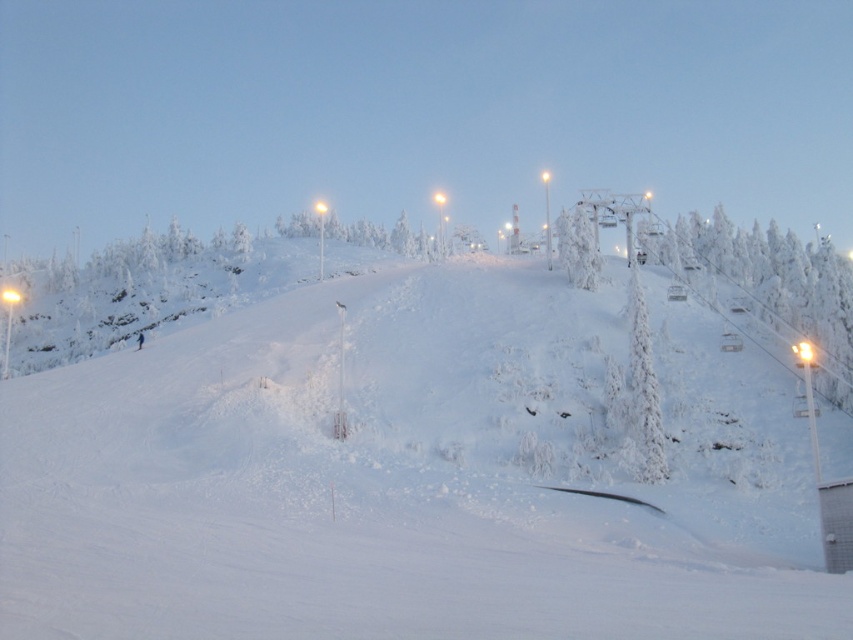
You are a skier planning to take a photo of the white frosty tree at upper center while standing on the white snow ski slope at center. Which direction should you face to capture the tree in your photo?

You should face to the right while standing on the white snow ski slope at center to capture the white frosty tree at upper center in your photo, since the ski slope is positioned to the left of the tree.